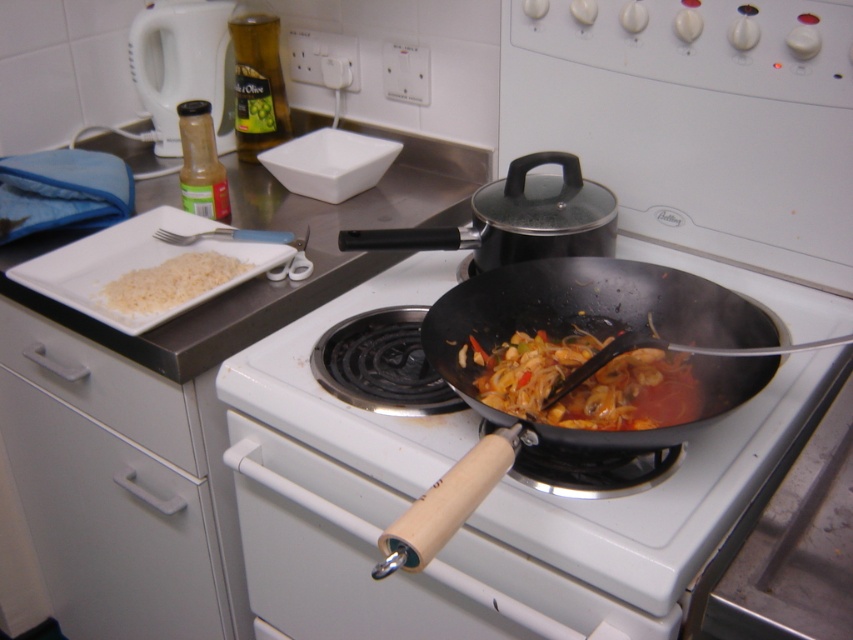
Question: Which point is farther from the camera taking this photo?

Choices:
 (A) (157, 74)
 (B) (244, 264)
 (C) (82, 404)

Answer: (A)

Question: Which object is the closest to the translucent plastic bottle at upper left?

Choices:
 (A) white matte rice at left
 (B) shiny silver pot at upper center
 (C) shiny orange stir-fry at center
 (D) gray matte drawer at lower left

Answer: (A)

Question: Based on their relative distances, which object is farther from the gray matte drawer at lower left?

Choices:
 (A) shiny orange stir-fry at center
 (B) translucent plastic bottle at upper left

Answer: (B)

Question: Is shiny orange stir-fry at center to the left of gray matte drawer at lower left from the viewer's perspective?

Choices:
 (A) yes
 (B) no

Answer: (B)

Question: Is black matte frying pan at center further to camera compared to white matte rice at left?

Choices:
 (A) no
 (B) yes

Answer: (A)

Question: Does shiny silver pot at upper center have a greater width compared to translucent plastic bottle at upper left?

Choices:
 (A) yes
 (B) no

Answer: (A)